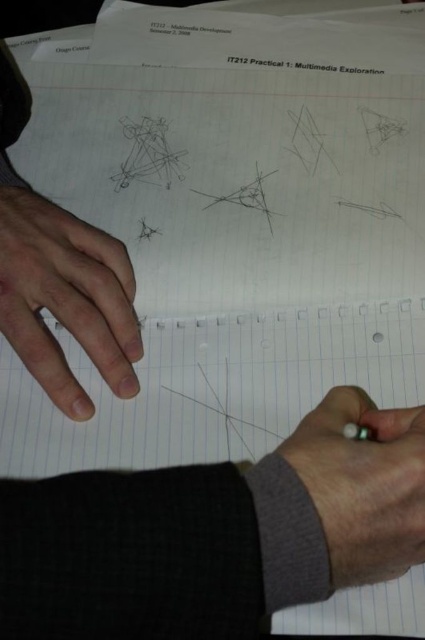
You are a photographer trying to capture a close detail of the gray woolen sweater at lower right without the dry skin at left blocking the view. Can you adjust your camera angle to achieve this?

The dry skin at left is further to the viewer than the gray woolen sweater at lower right, so adjusting the camera angle to move it closer to the sweater might allow you to capture the sweater without the dry skin blocking the view.

You are a dermatologist examining the image of the hands working on the notebook. You notice the dry skin at left. Can you determine its exact location on the paper?

The dry skin at left is located at point (x=65, y=298) on the paper.

You are an art student trying to determine the spatial relationship between two points on your drawing paper. You see a point at coordinates point (16,314) and another at point (333,403). Which point is closer to you?

Point (16,314) is behind point (333,403), so the point closer to you is point (333,403).